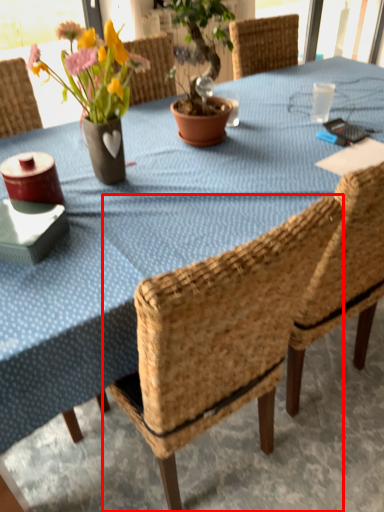
Question: From the image's perspective, considering the relative positions of chair (annotated by the red box) and floral arrangement in the image provided, where is chair (annotated by the red box) located with respect to the staircase?

Choices:
 (A) above
 (B) below

Answer: (B)